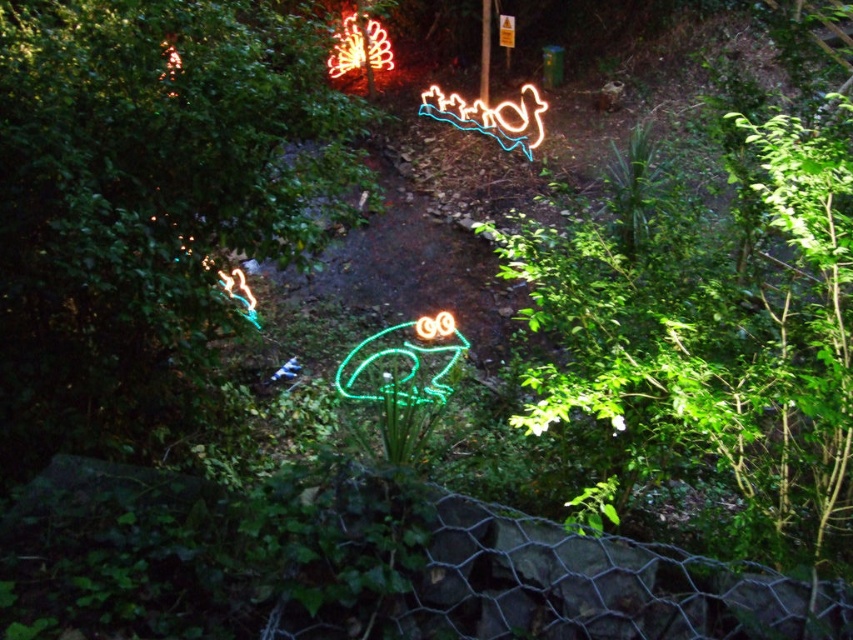
Question: Can you confirm if neon green frog at center is smaller than neon orange at upper center?

Choices:
 (A) no
 (B) yes

Answer: (B)

Question: Can you confirm if neon green frog at center is positioned to the right of neon orange at upper center?

Choices:
 (A) yes
 (B) no

Answer: (A)

Question: Where is neon green frog at center located in relation to neon orange at upper center in the image?

Choices:
 (A) right
 (B) left

Answer: (A)